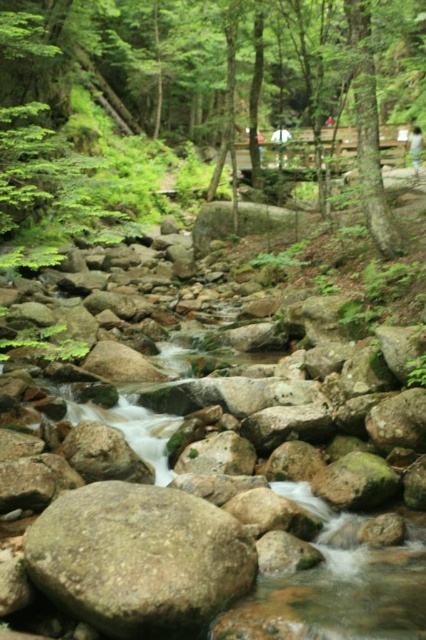
Question: Which point is farther to the camera?

Choices:
 (A) (29, 102)
 (B) (150, 534)

Answer: (A)

Question: Among these objects, which one is nearest to the camera?

Choices:
 (A) gray rough boulder at center
 (B) green matte tree at upper center

Answer: (A)

Question: Is green matte tree at upper center to the left of gray rough boulder at center from the viewer's perspective?

Choices:
 (A) no
 (B) yes

Answer: (A)

Question: Does green matte tree at upper center appear over gray rough boulder at center?

Choices:
 (A) yes
 (B) no

Answer: (A)

Question: Which point is farther to the camera?

Choices:
 (A) (313, 104)
 (B) (46, 579)

Answer: (A)

Question: Is green matte tree at upper center below gray rough boulder at center?

Choices:
 (A) no
 (B) yes

Answer: (A)